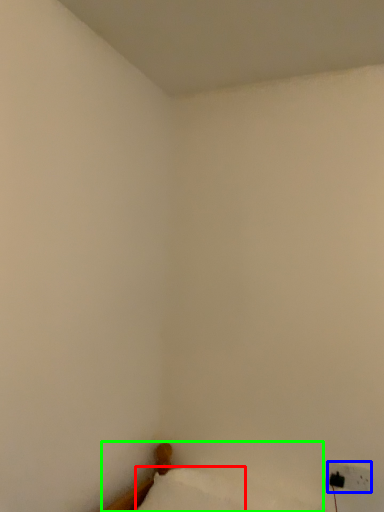
Question: Considering the real-world distances, which object is farthest from pillow (highlighted by a red box)? electric outlet (highlighted by a blue box) or furniture (highlighted by a green box)?

Choices:
 (A) electric outlet
 (B) furniture

Answer: (A)